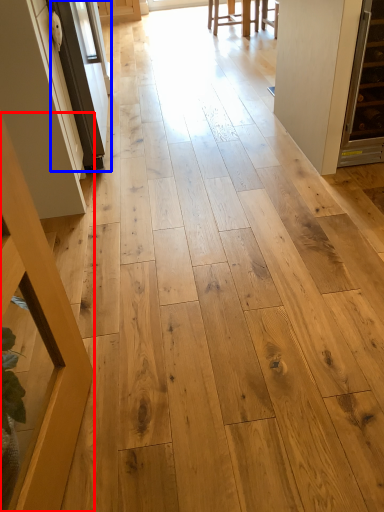
Question: Which object appears farthest to the camera in this image, furniture (highlighted by a red box) or screen door (highlighted by a blue box)?

Choices:
 (A) furniture
 (B) screen door

Answer: (B)